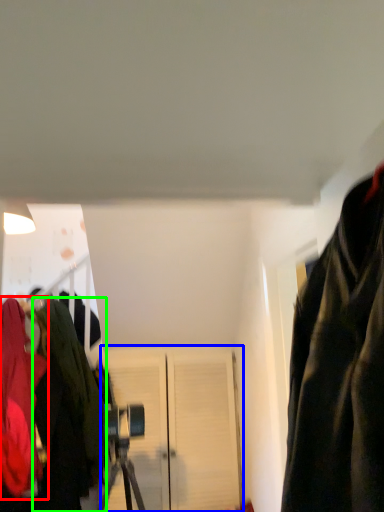
Question: Which object is the farthest from jacket (highlighted by a red box)? Choose among these: door (highlighted by a blue box) or jacket (highlighted by a green box).

Choices:
 (A) door
 (B) jacket

Answer: (A)